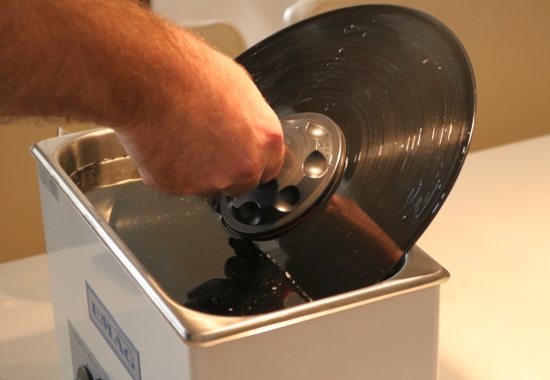
Where is `counter`? counter is located at coordinates (489, 288).